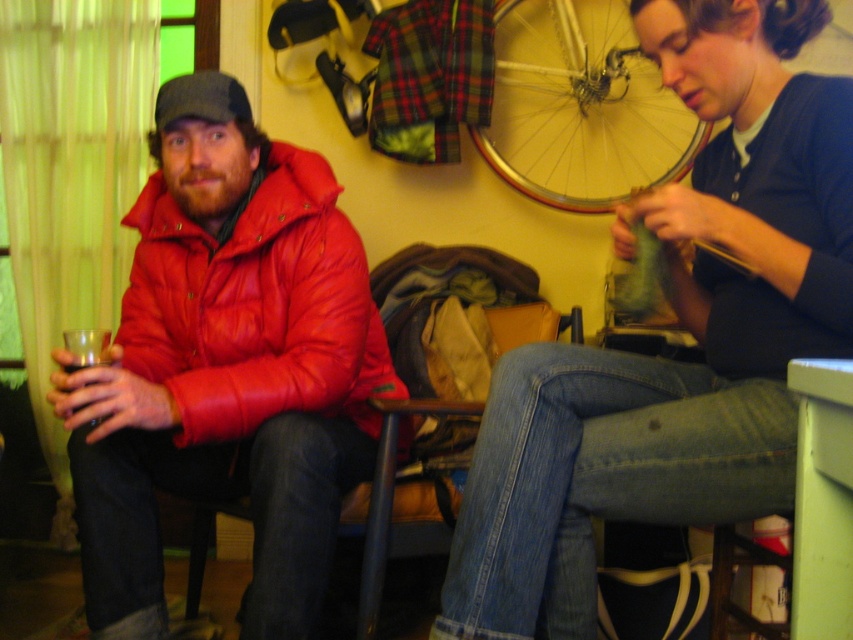
Does matte leather chair at center have a larger size compared to black matte cup at left?

Yes.

Does matte leather chair at center appear on the right side of black matte cup at left?

Indeed, matte leather chair at center is positioned on the right side of black matte cup at left.

Is point (193, 531) positioned in front of point (77, 365)?

No, (193, 531) is behind (77, 365).

At what (x,y) coordinates should I click in order to perform the action: click on matte leather chair at center. Please return your answer as a coordinate pair (x, y). The width and height of the screenshot is (853, 640). Looking at the image, I should click on (395, 506).

How far apart are denim jeans at center and black matte cup at left?

denim jeans at center is 34.98 inches from black matte cup at left.

Does denim jeans at center have a greater width compared to black matte cup at left?

Indeed, denim jeans at center has a greater width compared to black matte cup at left.

Does point (730, 93) lie in front of point (83, 362)?

Yes, point (730, 93) is closer to viewer.

This screenshot has width=853, height=640. I want to click on denim jeans at center, so click(x=685, y=326).

Looking at this image, is silver metallic bicycle wheel at upper center to the left of matte leather chair at center from the viewer's perspective?

No, silver metallic bicycle wheel at upper center is not to the left of matte leather chair at center.

Who is more distant from viewer, (608, 51) or (466, 460)?

Point (608, 51)

You are a GUI agent. You are given a task and a screenshot of the screen. Output one action in this format:
    pyautogui.click(x=<x>, y=<y>)
    Task: Click on the silver metallic bicycle wheel at upper center
    
    Given the screenshot: What is the action you would take?
    pyautogui.click(x=581, y=106)